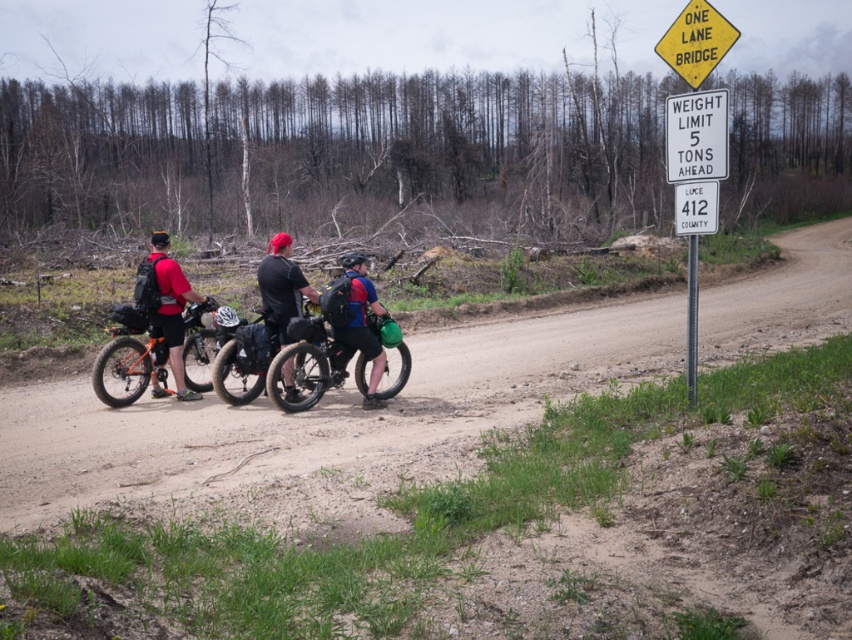
Question: Can you confirm if brown dirt track at center is bigger than white plastic sign at right?

Choices:
 (A) yes
 (B) no

Answer: (B)

Question: Does yellow plastic sign at upper right appear under black matte shirt at center?

Choices:
 (A) yes
 (B) no

Answer: (B)

Question: Which object appears farthest from the camera in this image?

Choices:
 (A) yellow diamond-shaped sign at upper right
 (B) matte black backpack at left
 (C) matte black bicycle at center
 (D) brown dirt track at center

Answer: (B)

Question: Which is farther from the yellow diamond-shaped sign at upper right?

Choices:
 (A) yellow plastic sign at upper right
 (B) white plastic sign at right

Answer: (A)

Question: Does matte black bicycle at center appear on the left side of white plastic sign at right?

Choices:
 (A) yes
 (B) no

Answer: (A)

Question: Which point is closer to the camera?

Choices:
 (A) matte black backpack at left
 (B) yellow diamond-shaped sign at upper right

Answer: (B)